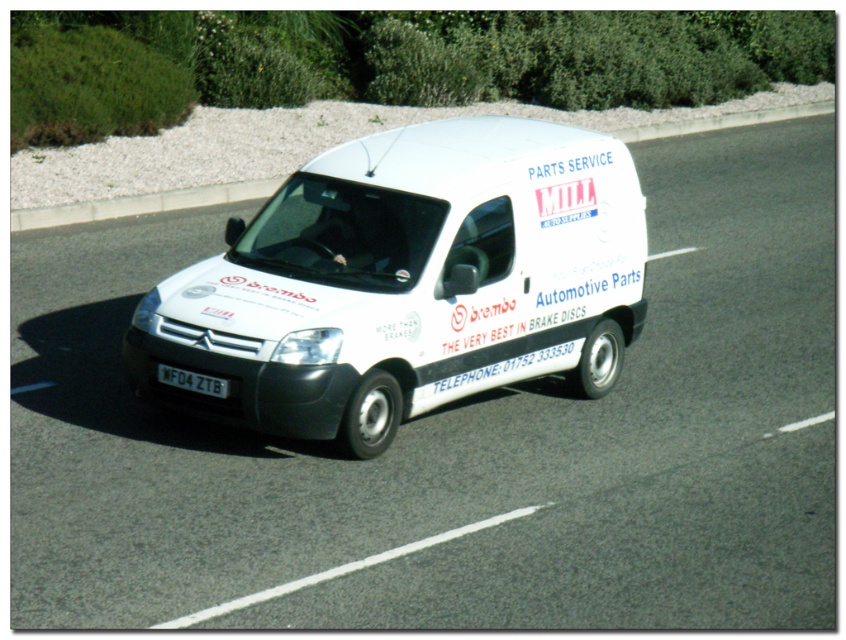
Question: Can you confirm if white matte van at center is thinner than white concrete curb at upper center?

Choices:
 (A) yes
 (B) no

Answer: (A)

Question: Which object appears closest to the camera in this image?

Choices:
 (A) white concrete curb at upper center
 (B) white matte van at center

Answer: (B)

Question: Is white matte van at center wider than black plastic license plate at bottom center?

Choices:
 (A) no
 (B) yes

Answer: (B)

Question: Can you confirm if white matte van at center is positioned to the right of white concrete curb at upper center?

Choices:
 (A) no
 (B) yes

Answer: (A)

Question: Which point is closer to the camera?

Choices:
 (A) (206, 204)
 (B) (168, 380)

Answer: (B)

Question: Which object is the farthest from the white concrete curb at upper center?

Choices:
 (A) white matte van at center
 (B) black plastic license plate at bottom center

Answer: (B)